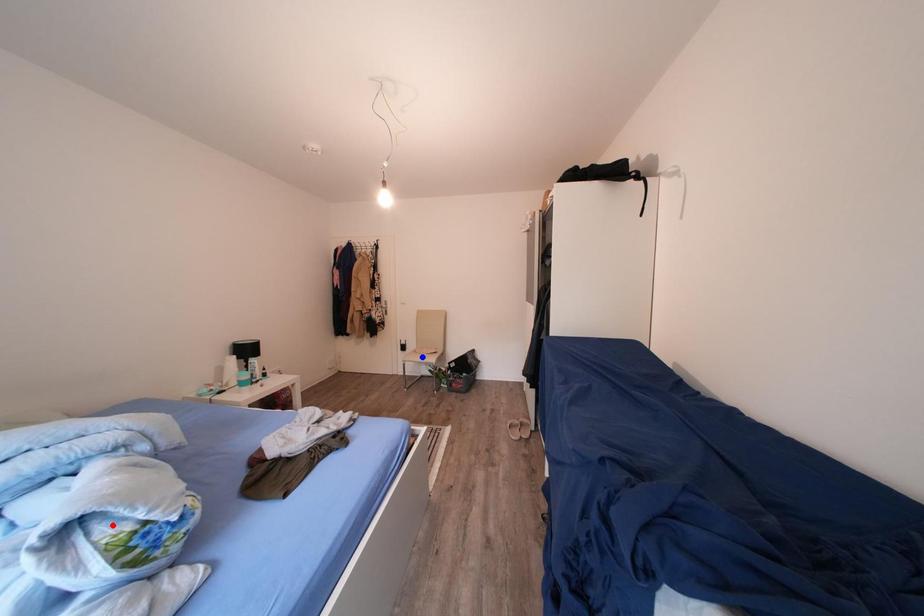
Question: Two points are marked on the image. Which point is closer to the camera?

Choices:
 (A) Blue point is closer.
 (B) Red point is closer.

Answer: (B)